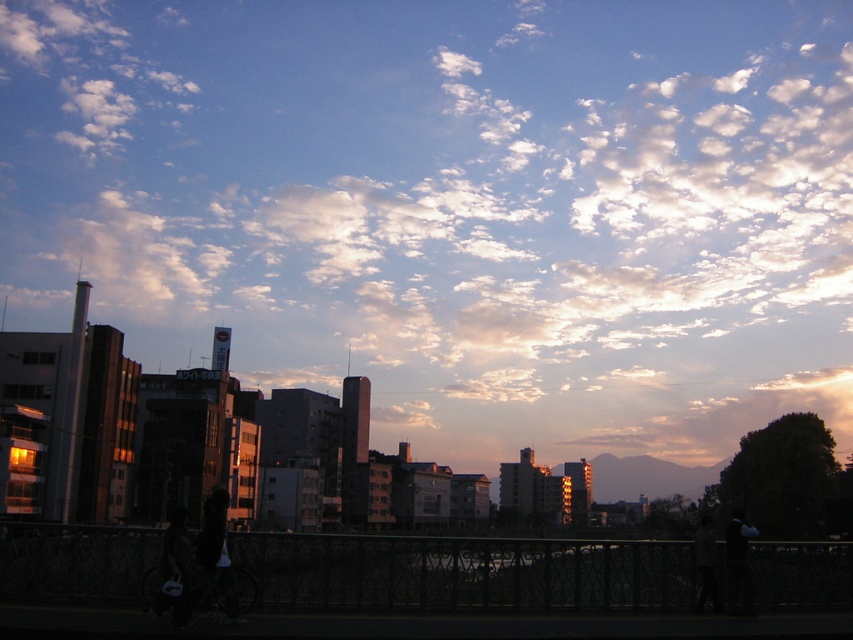
Does white fluffy cloud at upper center have a lesser height compared to dark blue fabric jacket at lower right?

No.

Which is more to the right, white fluffy cloud at upper center or dark blue fabric jacket at lower right?

Positioned to the right is dark blue fabric jacket at lower right.

At what (x,y) coordinates should I click in order to perform the action: click on white fluffy cloud at upper center. Please return your answer as a coordinate pair (x, y). This screenshot has width=853, height=640. Looking at the image, I should click on (451, 205).

Which is more to the right, dark fabric jacket at lower left or dark blue fabric jacket at lower right?

dark blue fabric jacket at lower right

Locate an element on the screen. dark fabric jacket at lower left is located at coordinates (175, 570).

Locate an element on the screen. dark fabric jacket at lower left is located at coordinates [x=175, y=570].

Can you confirm if white fluffy cloud at upper center is smaller than dark gray jacket at lower right?

No, white fluffy cloud at upper center is not smaller than dark gray jacket at lower right.

Is point (502, 10) in front of point (704, 584)?

That is False.

You are a GUI agent. You are given a task and a screenshot of the screen. Output one action in this format:
    pyautogui.click(x=<x>, y=<y>)
    Task: Click on the white fluffy cloud at upper center
    
    Given the screenshot: What is the action you would take?
    pyautogui.click(x=451, y=205)